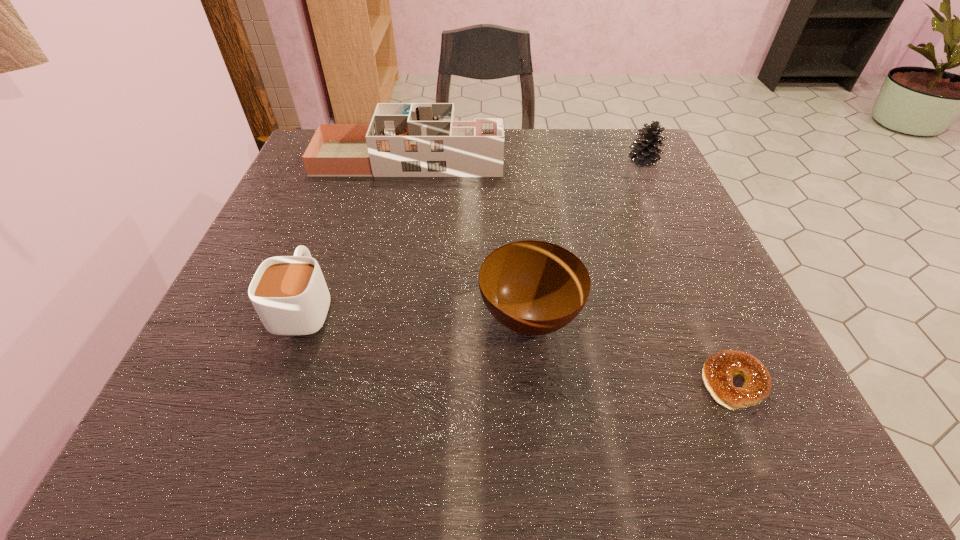
Find the location of `object positioned at the far right corner`. object positioned at the far right corner is located at coordinates (645, 152).

The image size is (960, 540). Find the location of `object that is at the near right corner`. object that is at the near right corner is located at coordinates (719, 369).

In the image, there is a desktop. Where is `vacant space at the far edge`? This screenshot has height=540, width=960. vacant space at the far edge is located at coordinates (536, 156).

The width and height of the screenshot is (960, 540). In the image, there is a desktop. In order to click on free space at the near edge in this screenshot , I will do `click(496, 408)`.

This screenshot has width=960, height=540. Identify the location of free space at the left edge of the desktop. (325, 210).

At what (x,y) coordinates should I click in order to perform the action: click on free space at the right edge of the desktop. Please return your answer as a coordinate pair (x, y). This screenshot has height=540, width=960. Looking at the image, I should click on (692, 276).

Locate an element on the screen. The width and height of the screenshot is (960, 540). vacant area at the near left corner of the desktop is located at coordinates (185, 443).

The image size is (960, 540). Identify the location of free space between the cup and the bagel. (519, 344).

Locate an element on the screen. empty space that is in between the pinecone and the cup is located at coordinates (474, 233).

Find the location of a particular element. Image resolution: width=960 pixels, height=540 pixels. vacant area between the bowl and the pinecone is located at coordinates (587, 239).